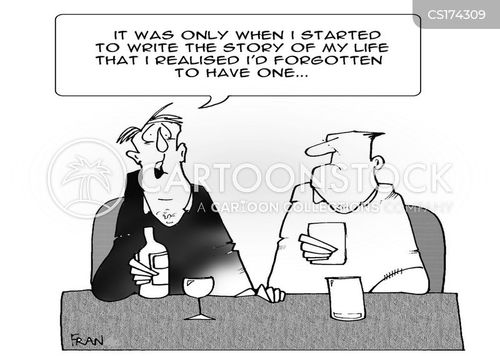
This screenshot has width=500, height=356. What are the coordinates of `table` in the screenshot? It's located at (302, 321).